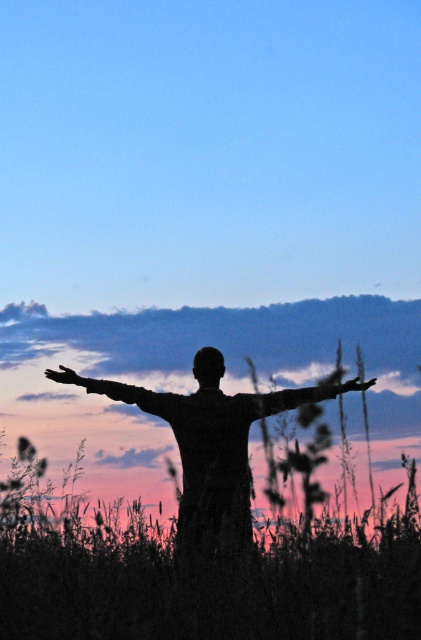
You are standing in the scene and want to place a small flag at the point that is closer to you. Which point should you choose between point (x=178, y=572) and point (x=143, y=403)?

Point (x=178, y=572) is closer to the camera than point (x=143, y=403), so you should choose point (x=178, y=572) to place the flag.